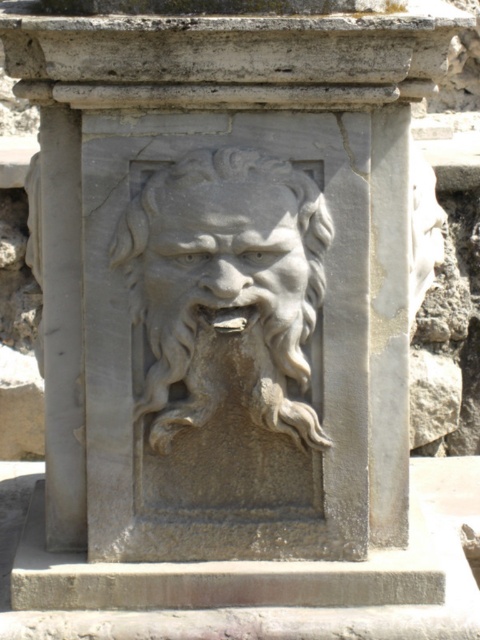
You are an architect examining the stone relief sculpture. You notice two central elements, the gray stone lion at center and the gray stone face at center. Which of these two objects is bigger in size?

The gray stone lion at center has a larger size compared to the gray stone face at center, so the gray stone lion at center is bigger.

You are an art conservator examining the stone relief sculpture. You notice two gray stone elements at the center. Which one is closer to you, the gray stone lion at center or the gray stone face at center?

The gray stone lion at center is closer to you than the gray stone face at center because it is further to the viewer.